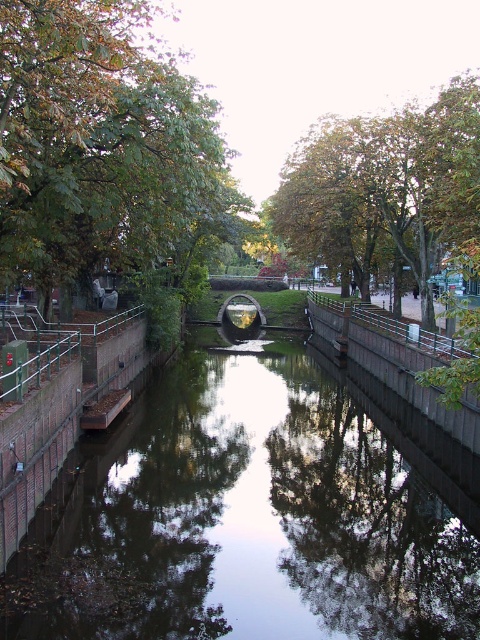
Question: Is green leafy tree at center in front of green leafy tree at upper center?

Choices:
 (A) no
 (B) yes

Answer: (B)

Question: Estimate the real-world distances between objects in this image. Which object is farther from the green leafy tree at upper center?

Choices:
 (A) green leafy tree at center
 (B) smooth concrete canal at center

Answer: (B)

Question: Which of the following is the closest to the observer?

Choices:
 (A) (97, 614)
 (B) (312, 230)
 (C) (142, 179)

Answer: (A)

Question: Which object is closer to the camera taking this photo?

Choices:
 (A) green leafy tree at center
 (B) green leafy tree at upper center
 (C) smooth concrete canal at center

Answer: (C)

Question: Does smooth concrete canal at center appear on the left side of green leafy tree at center?

Choices:
 (A) no
 (B) yes

Answer: (A)

Question: Can you confirm if smooth concrete canal at center is positioned below green leafy tree at center?

Choices:
 (A) no
 (B) yes

Answer: (B)